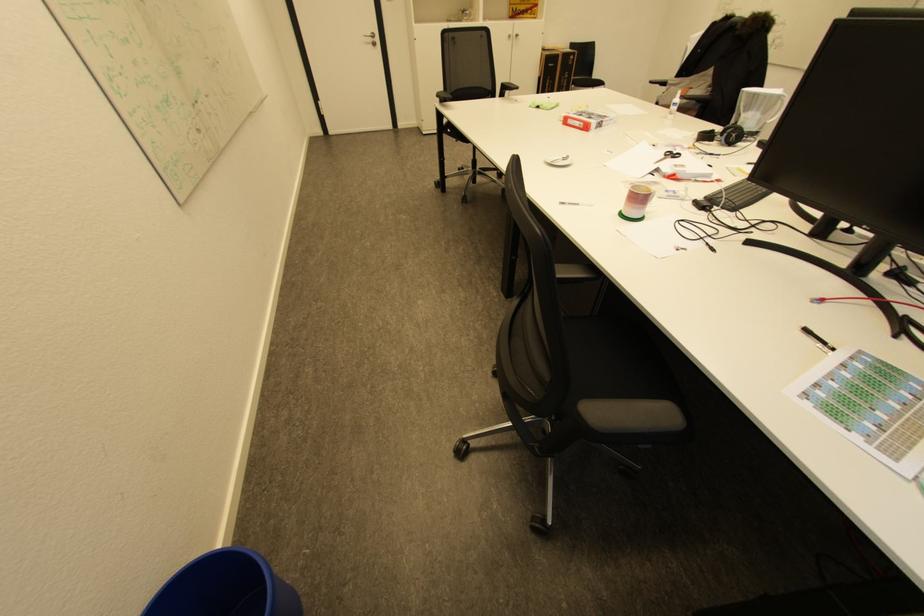
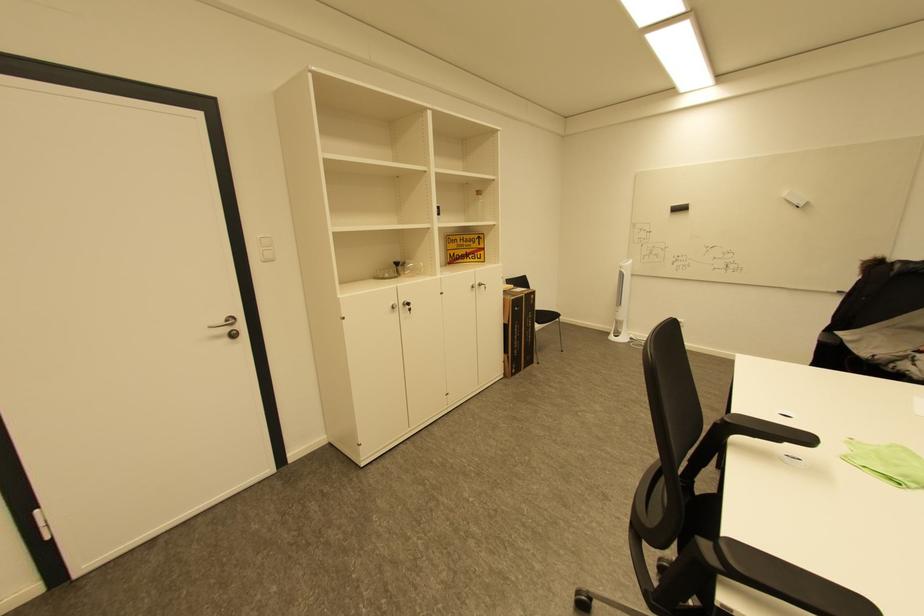
Locate, in the second image, the point that corresponds to (x=516, y=37) in the first image.

(479, 286)